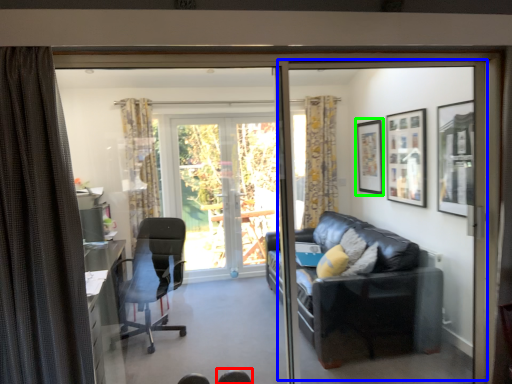
Question: Based on their relative distances, which object is farther from chair (highlighted by a red box)? Choose from screen door (highlighted by a blue box) and picture frame (highlighted by a green box).

Choices:
 (A) screen door
 (B) picture frame

Answer: (A)